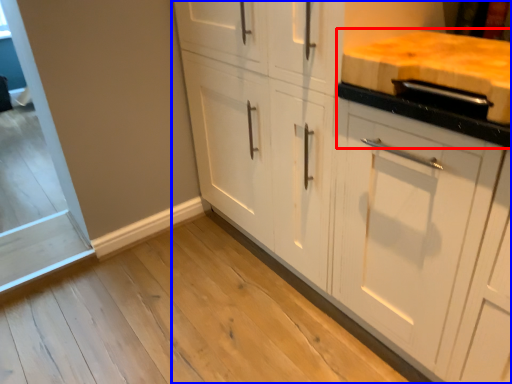
Question: Which object is further to the camera taking this photo, countertop (highlighted by a red box) or cabinetry (highlighted by a blue box)?

Choices:
 (A) countertop
 (B) cabinetry

Answer: (B)